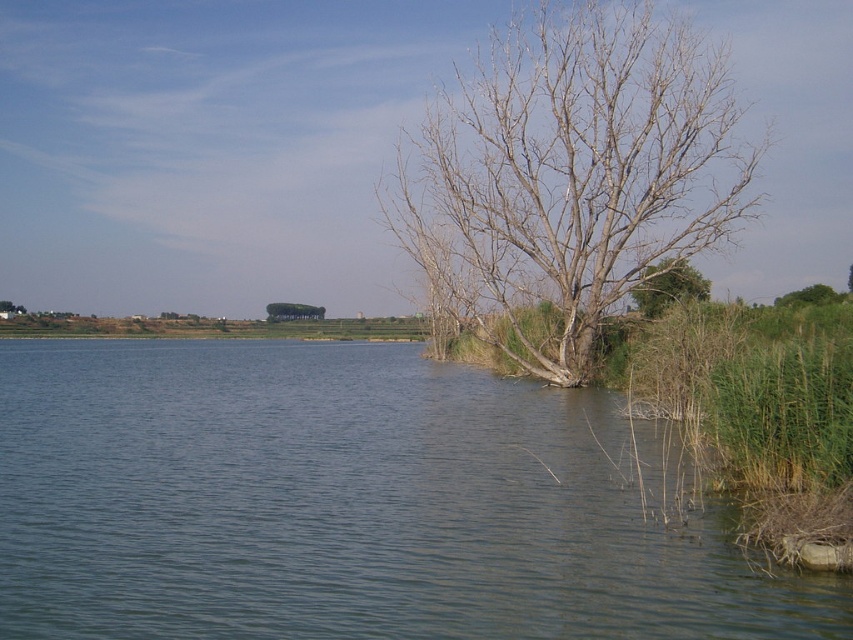
You are standing at the lakeside and want to walk to the point marked as point (322, 310). There is an obstacle at point (628, 536). Will you encounter the obstacle before reaching your destination?

Yes, you will encounter the obstacle at point (628, 536) before reaching your destination at point (322, 310) because point (628, 536) is in front of point (322, 310).

You are standing at the lakeside and see the point marked at coordinates [567,177]. Based on the scene description, can you tell me what object this point is located on?

The point at coordinates [567,177] is located on the bare wood tree at center.